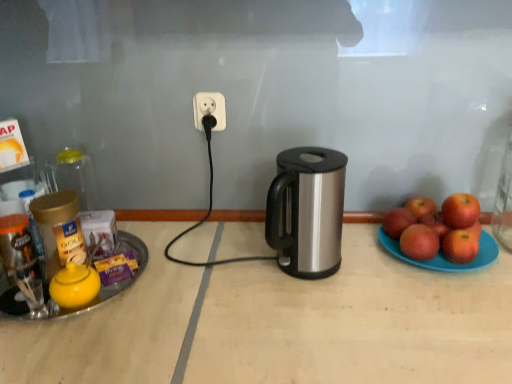
Question: Is red matte apple at right, positioned as the 5th apple in front-to-back order, at the left side of silver metallic kettle at center?

Choices:
 (A) no
 (B) yes

Answer: (A)

Question: Is red matte apple at right, positioned as the 5th apple in front-to-back order, positioned in front of silver metallic kettle at center?

Choices:
 (A) no
 (B) yes

Answer: (A)

Question: From a real-world perspective, is red matte apple at right, arranged as the second apple when viewed from the back, over silver metallic kettle at center?

Choices:
 (A) no
 (B) yes

Answer: (A)

Question: Considering the relative sizes of red matte apple at right, positioned as the 5th apple in front-to-back order, and silver metallic kettle at center in the image provided, is red matte apple at right, positioned as the 5th apple in front-to-back order, smaller than silver metallic kettle at center?

Choices:
 (A) no
 (B) yes

Answer: (B)

Question: From a real-world perspective, is red matte apple at right, positioned as the 5th apple in front-to-back order, physically below silver metallic kettle at center?

Choices:
 (A) no
 (B) yes

Answer: (B)

Question: From their relative heights in the image, would you say red matte apple at right, arranged as the second apple when viewed from the back, is taller or shorter than gold plastic jar at left, the third bottle in the back-to-front sequence?

Choices:
 (A) short
 (B) tall

Answer: (A)

Question: From a real-world perspective, relative to gold plastic jar at left, the third bottle in the back-to-front sequence, is red matte apple at right, positioned as the 5th apple in front-to-back order, vertically above or below?

Choices:
 (A) below
 (B) above

Answer: (A)

Question: Does point (397, 208) appear closer or farther from the camera than point (45, 195)?

Choices:
 (A) farther
 (B) closer

Answer: (A)

Question: Considering their positions, is red matte apple at right, arranged as the second apple when viewed from the back, located in front of or behind gold plastic jar at left, the third bottle in the back-to-front sequence?

Choices:
 (A) behind
 (B) front

Answer: (A)

Question: Is transparent glass jar at left, arranged as the third bottle when viewed from the front, to the left or to the right of white plastic power outlet at center in the image?

Choices:
 (A) right
 (B) left

Answer: (B)

Question: From the image's perspective, is transparent glass jar at left, arranged as the third bottle when viewed from the front, above or below white plastic power outlet at center?

Choices:
 (A) above
 (B) below

Answer: (B)

Question: Is point (88, 188) closer or farther from the camera than point (216, 125)?

Choices:
 (A) farther
 (B) closer

Answer: (A)

Question: Considering the positions of transparent glass jar at left, positioned as the 1th bottle in back-to-front order, and white plastic power outlet at center in the image, is transparent glass jar at left, positioned as the 1th bottle in back-to-front order, wider or thinner than white plastic power outlet at center?

Choices:
 (A) wide
 (B) thin

Answer: (A)

Question: Would you say red matte apple at right, the sixth apple positioned from the back, is to the left or to the right of red matte apple at right, the third apple from the back, in the picture?

Choices:
 (A) right
 (B) left

Answer: (A)

Question: Do you think red matte apple at right, placed as the 1th apple when sorted from front to back, is within red matte apple at right, which is counted as the fourth apple, starting from the front, or outside of it?

Choices:
 (A) outside
 (B) inside

Answer: (A)